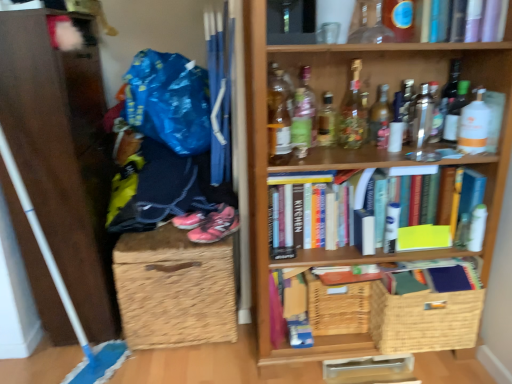
What are the coordinates of `vacant space underneath pink suede sneakers at lower center (from a real-world perspective)` in the screenshot? It's located at (219, 239).